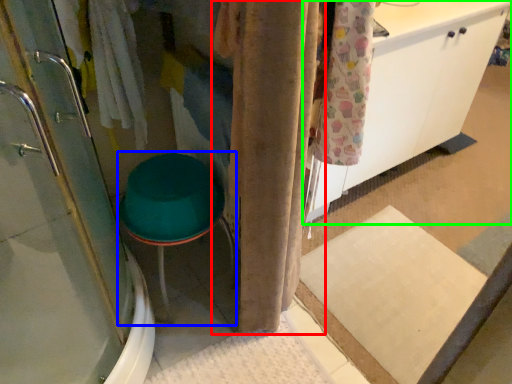
Question: Which object is the farthest from curtain (highlighted by a red box)? Choose among these: step stool (highlighted by a blue box) or cabinetry (highlighted by a green box).

Choices:
 (A) step stool
 (B) cabinetry

Answer: (B)